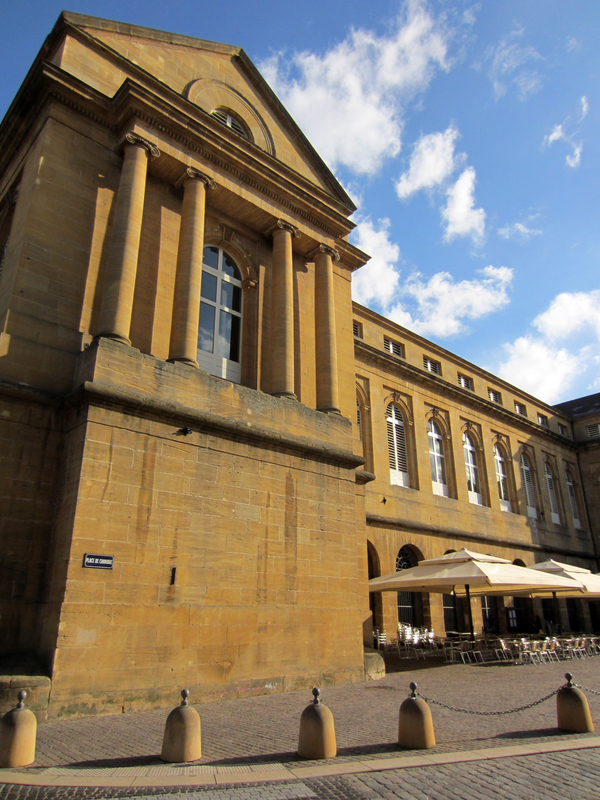
Image resolution: width=600 pixels, height=800 pixels. I want to click on chair, so click(523, 656).